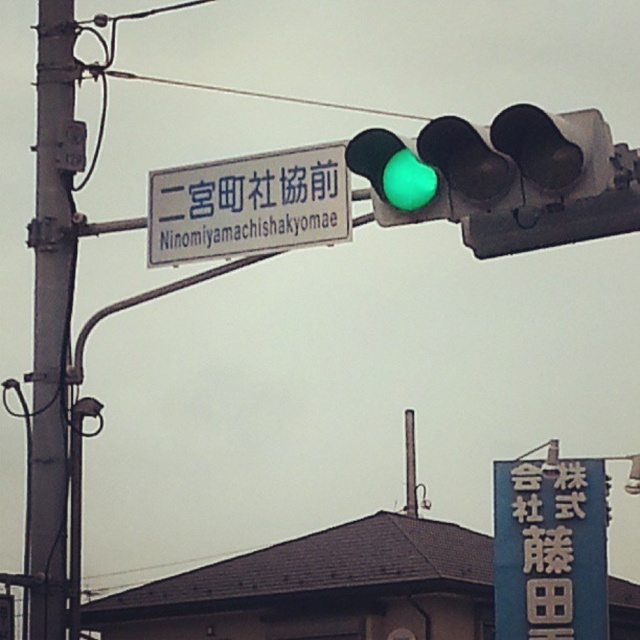
You are a pedestrian standing on the sidewalk and see the green glass traffic light at upper center and the white plastic sign at upper center. Which object is nearer to you?

The green glass traffic light at upper center is closer to the viewer than the white plastic sign at upper center.

You are a city planner analyzing the layout of this urban intersection. You need to determine if the green glass traffic light at upper center can be replaced with a larger model that is 1.5 times wider than the current one. The white plastic sign at upper center must remain in its position and size. Can the new traffic light fit without overlapping the sign?

The green glass traffic light at upper center is currently narrower than the white plastic sign at upper center. If the new traffic light is 1.5 times wider, it might overlap with the sign since the sign cannot be moved. Therefore, the new traffic light may not fit without overlapping.

You are standing at point A at (426, 198) and want to reach point B at 0.689, 0.333. The distance between them is 7.62 meters. If you walk at a speed of 1.5 meters per second, how many seconds will it take you to reach point B?

The distance between point A at (426, 198) and point B at 0.689, 0.333 is 7.62 meters. At a walking speed of 1.5 meters per second, it will take 7.62 divided by 1.5, which equals approximately 5.08 seconds to reach point B.